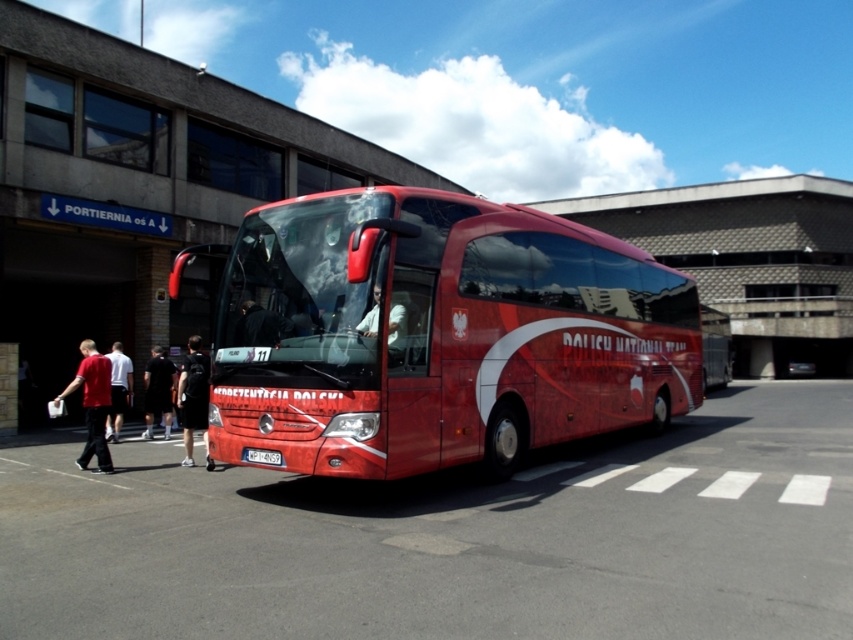
You are a photographer standing at the back of the red coach bus. You want to take a photo of the matte red shirt at left and the black fabric pants at lower left so that both are clearly visible in the frame. Given their distance apart, can you fit both subjects into your camera viewfinder without moving your position?

The matte red shirt at left and black fabric pants at lower left are 3.86 meters apart from each other. Since the photographer is at the back of the bus, the distance between them may be too large to fit both into the camera viewfinder without moving.

You are standing at the back of the red coach bus parked in front of the building. You notice two points marked on the ground near the bus. The first point is at coordinates point (196, 342) and the second is at point (239, 333). Which point is closer to you?

Point (196, 342) is closer to you because it is further to the viewer than point (239, 333).

You are standing in front of the red coach bus parked under a bright blue sky. You see a point marked at coordinates (91, 403). What object is located at this point?

The point at (91, 403) corresponds to the matte red shirt at left.